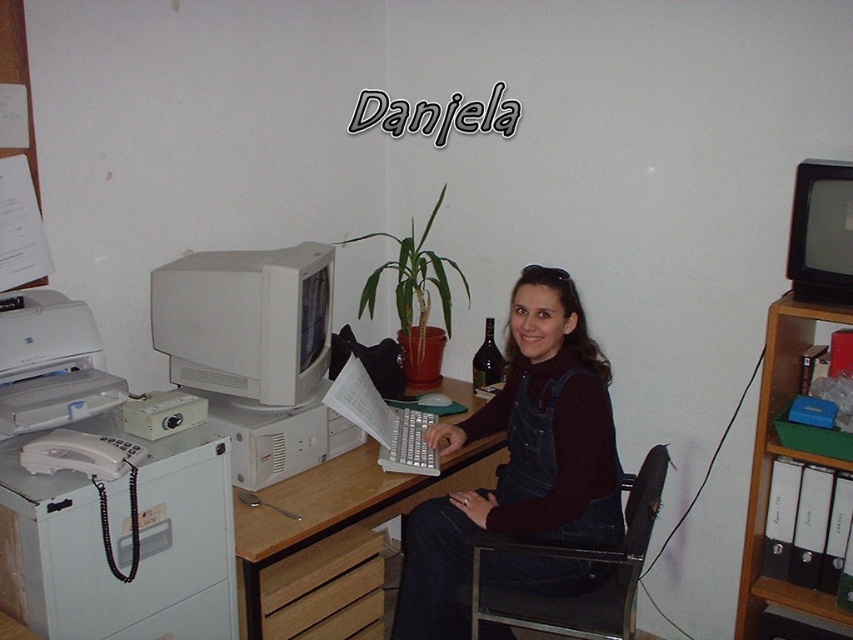
You are organizing the desk and need to move items closer to you. Which object, the matte black laptop at center or the white plastic printer at left, is already closer to you?

The matte black laptop at center is closer to you because it is positioned further to the viewer than the white plastic printer at left.